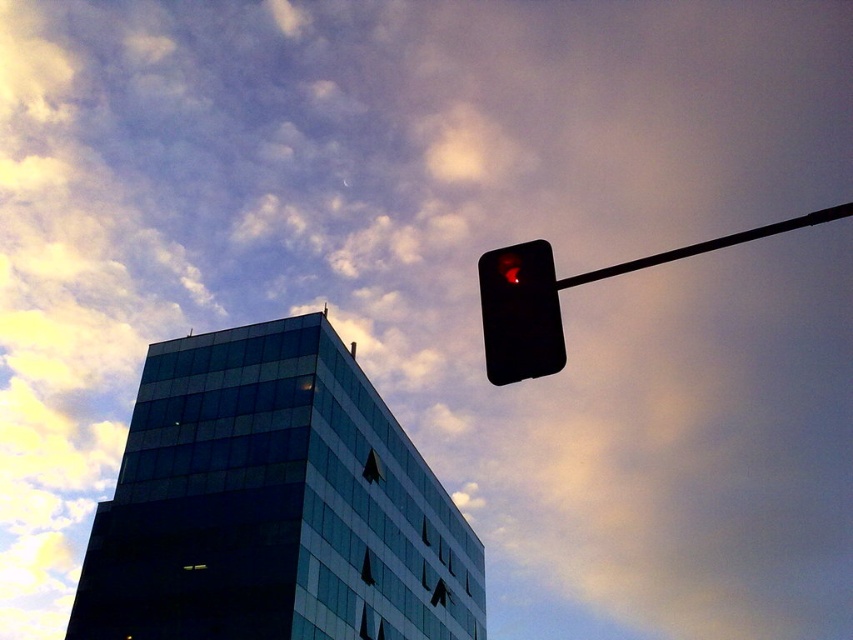
Question: From the image, what is the correct spatial relationship of black matte traffic light at upper right in relation to black plastic pole at upper right?

Choices:
 (A) right
 (B) left

Answer: (B)

Question: Does black matte traffic light at upper right have a larger size compared to black plastic pole at upper right?

Choices:
 (A) no
 (B) yes

Answer: (A)

Question: Considering the relative positions of black matte traffic light at upper right and black plastic pole at upper right in the image provided, where is black matte traffic light at upper right located with respect to black plastic pole at upper right?

Choices:
 (A) above
 (B) below

Answer: (B)

Question: Which object appears farthest from the camera in this image?

Choices:
 (A) black matte traffic light at upper right
 (B) black plastic pole at upper right

Answer: (B)